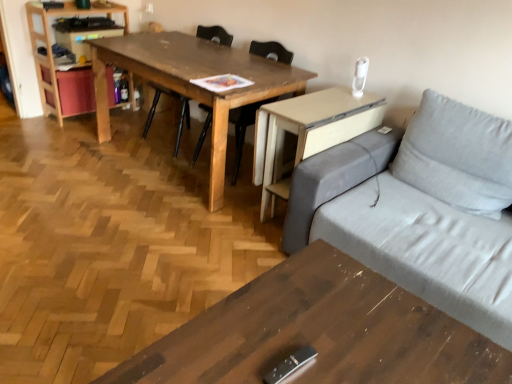
Image resolution: width=512 pixels, height=384 pixels. In order to click on free point to the left of wooden table at center, acting as the first table starting from the back in this screenshot , I will do `click(67, 155)`.